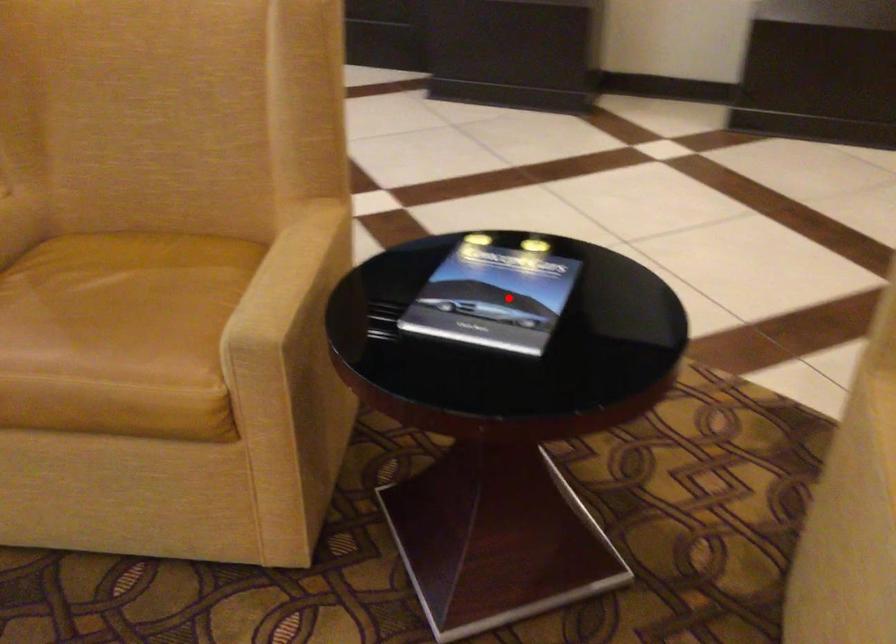
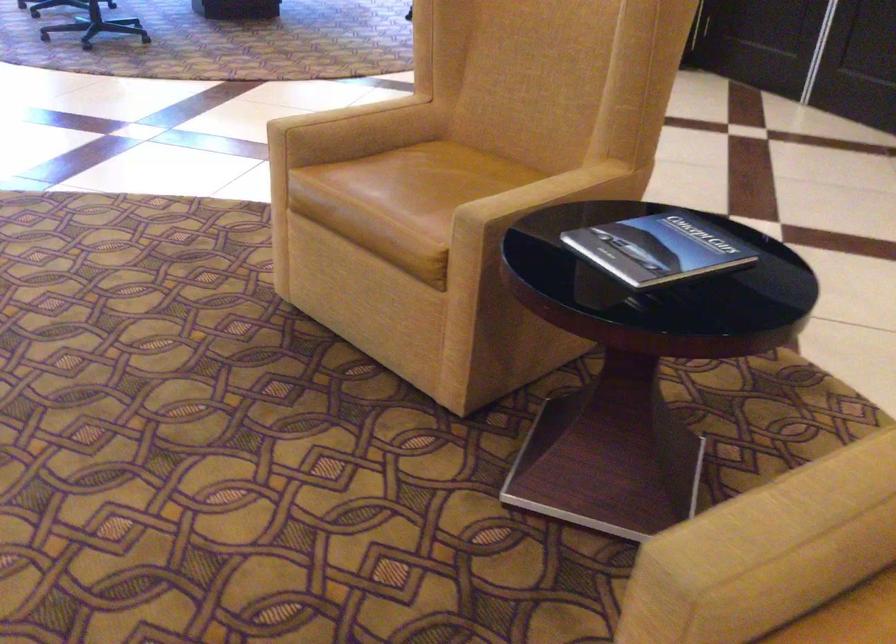
Where in the second image is the point corresponding to the highlighted location from the first image?

(657, 249)